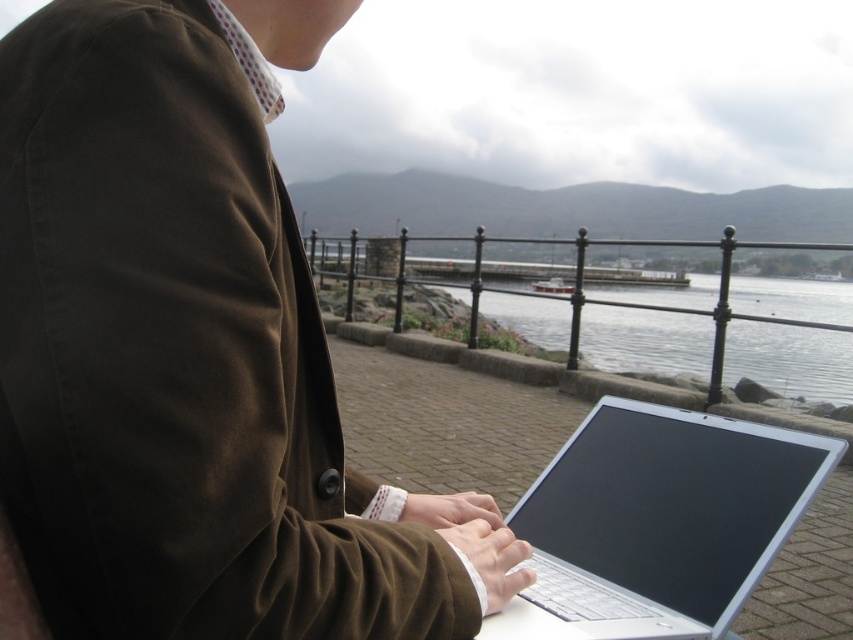
You are a delivery drone that needs to drop off a package to the person at the silver metallic laptop at center. The package is 1 meter in length. Can you safely hover above the clear water at center to make the delivery without the package hitting the water?

The distance between the silver metallic laptop at center and the clear water at center is 8.18 meters. Since the package is 1 meter long, the drone can safely hover above the clear water at center and deliver the package without it hitting the water as there is sufficient space between the two points.

You are organizing a backpacking trip and need to pack both the brown cotton jacket at center and the silver metallic laptop at center. Based on their sizes, which item should you place first into your backpack to maximize space efficiency?

The brown cotton jacket at center has a lesser width compared to the silver metallic laptop at center, so you should place the silver metallic laptop at center first to maximize space efficiency by putting larger items first.

You are holding a 16 inch ruler. You want to measure the distance from your eyes to the point at coordinates point (79,291). Can you reach it with your ruler?

The point at coordinates point (79,291) is 15.92 inches from the viewer, so yes, the ruler can reach it since it is shorter than the ruler length.